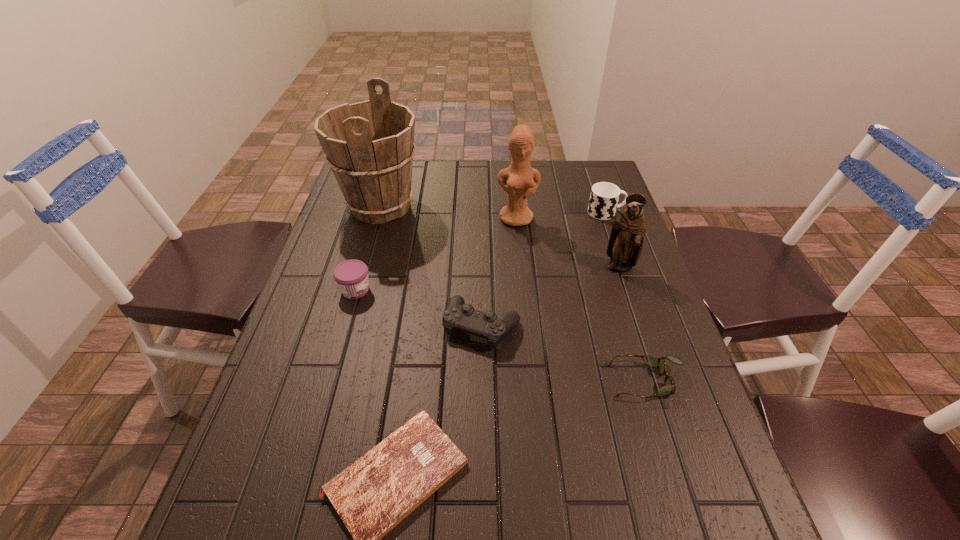
Locate an element on the screen. empty space that is in between the cup and the seventh tallest object is located at coordinates (627, 296).

You are a GUI agent. You are given a task and a screenshot of the screen. Output one action in this format:
    pyautogui.click(x=<x>, y=<y>)
    Task: Click on the blank region between the nearer figurine and the control
    The height and width of the screenshot is (540, 960).
    Given the screenshot: What is the action you would take?
    pyautogui.click(x=550, y=297)

At what (x,y) coordinates should I click in order to perform the action: click on vacant area that lies between the farther figurine and the tallest object. Please return your answer as a coordinate pair (x, y). Looking at the image, I should click on (448, 212).

Locate an element on the screen. The height and width of the screenshot is (540, 960). free point between the jam and the bucket is located at coordinates (368, 248).

This screenshot has width=960, height=540. Find the location of `vacant space that is in between the cup and the jam`. vacant space that is in between the cup and the jam is located at coordinates (481, 251).

Identify the location of unoccupied position between the fourth tallest object and the seventh shortest object. This screenshot has height=540, width=960. click(x=562, y=215).

Where is `free space between the farther figurine and the jam`? free space between the farther figurine and the jam is located at coordinates (436, 254).

Where is `object that is the fifth closest one to the cup`? This screenshot has height=540, width=960. object that is the fifth closest one to the cup is located at coordinates (369, 145).

Locate an element on the screen. The width and height of the screenshot is (960, 540). object that is the third closest to the tallest object is located at coordinates (457, 315).

What are the coordinates of `free space that satisfies the following two spatial constraints: 1. on the side of the fourth tallest object with the handle; 2. on the front-facing side of the nearer figurine` in the screenshot? It's located at (625, 268).